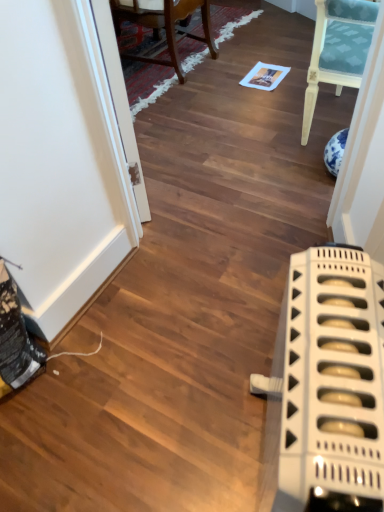
This screenshot has height=512, width=384. What are the coordinates of `vacant space behind transparent glass door at upper left` in the screenshot? It's located at (167, 119).